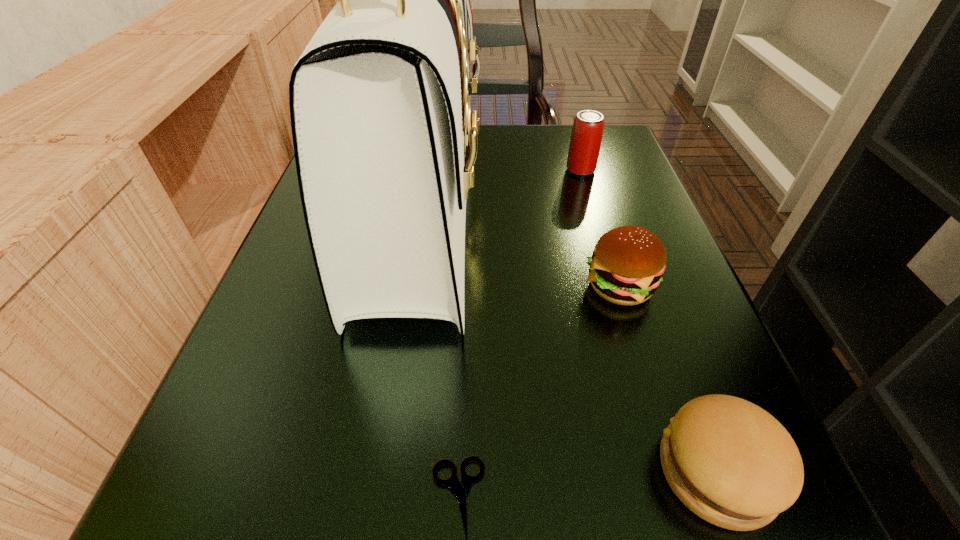
The image size is (960, 540). Identify the location of object that is the second nearest to the second tallest object. (627, 264).

The image size is (960, 540). In order to click on vacant space that satisfies the following two spatial constraints: 1. on the front-facing side of the satchel; 2. on the back side of the third shortest object in this screenshot , I will do `click(408, 286)`.

Where is `free region that satisfies the following two spatial constraints: 1. on the front-facing side of the tallest object; 2. on the back side of the nearer hamburger`? The width and height of the screenshot is (960, 540). free region that satisfies the following two spatial constraints: 1. on the front-facing side of the tallest object; 2. on the back side of the nearer hamburger is located at coordinates (379, 471).

The width and height of the screenshot is (960, 540). I want to click on free point that satisfies the following two spatial constraints: 1. on the front-facing side of the satchel; 2. on the left side of the farther hamburger, so click(408, 286).